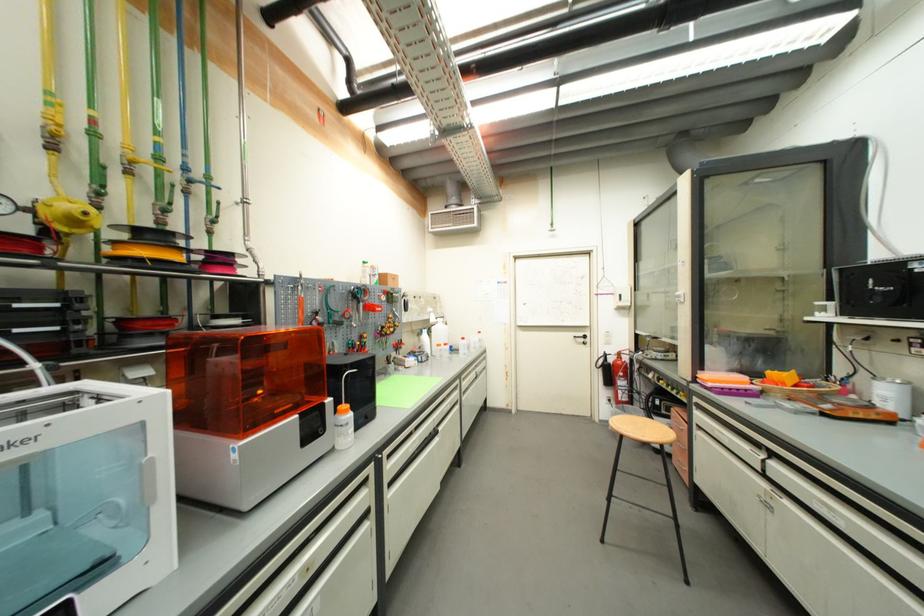
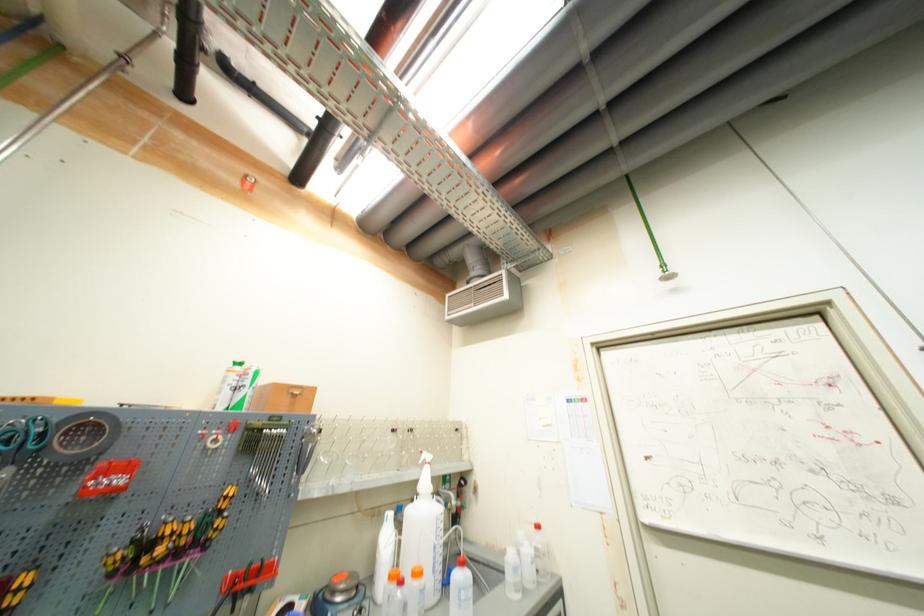
The point at (x=371, y=338) is marked in the first image. Where is the corresponding point in the second image?

(30, 581)